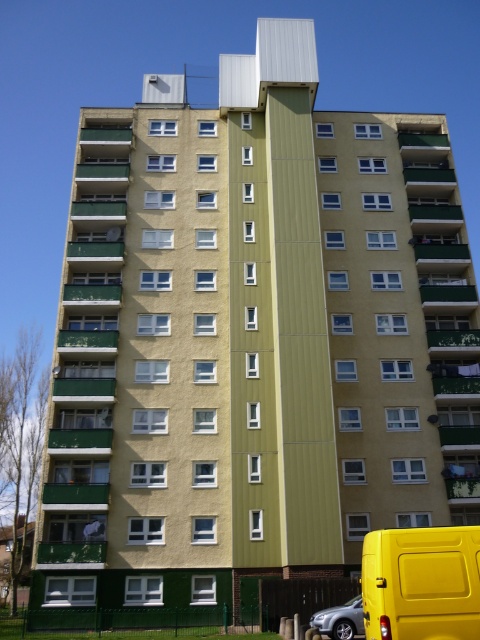
You are standing in front of the residential building and want to park your car. You see a yellow matte van at lower right and a silver metallic car at lower center. Which parking spot is closer to you?

The yellow matte van at lower right is closer to the viewer than the silver metallic car at lower center, so the parking spot where the yellow matte van is parked is closer to you.

You are a delivery driver who needs to park your vehicle in the parking lot near the residential building. You have a yellow matte van at lower right and a silver metallic car at lower center. Which vehicle can you park in the standard parking spot that is 1.5 meters in height?

The silver metallic car at lower center can be parked in the standard parking spot since it is shorter than the yellow matte van at lower right, and the parking spot has a height limit of 1.5 meters.